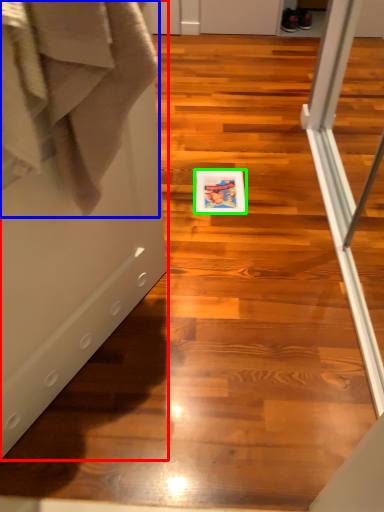
Question: Which object is positioned closest to screen door (highlighted by a red box)? Select from bath towel (highlighted by a blue box) and postcard (highlighted by a green box).

Choices:
 (A) bath towel
 (B) postcard

Answer: (A)